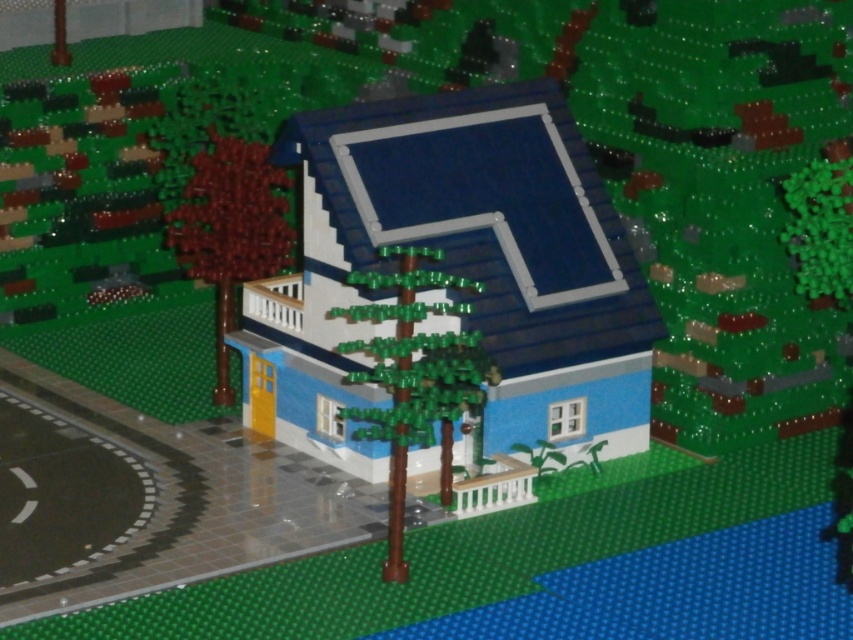
Question: Which point is closer to the camera taking this photo?

Choices:
 (A) (374, 368)
 (B) (248, 168)
 (C) (822, 208)

Answer: (A)

Question: Is green matte tree at center bigger than green matte tree at right?

Choices:
 (A) no
 (B) yes

Answer: (B)

Question: Which point is closer to the camera?

Choices:
 (A) brown matte tree at left
 (B) green matte tree at right
 (C) green matte tree at center

Answer: (B)

Question: Can you confirm if green matte tree at center is bigger than brown matte tree at left?

Choices:
 (A) no
 (B) yes

Answer: (B)

Question: Does green matte tree at center have a greater width compared to brown matte tree at left?

Choices:
 (A) no
 (B) yes

Answer: (B)

Question: Which point appears farthest from the camera in this image?

Choices:
 (A) (263, 154)
 (B) (332, 312)
 (C) (822, 180)

Answer: (A)